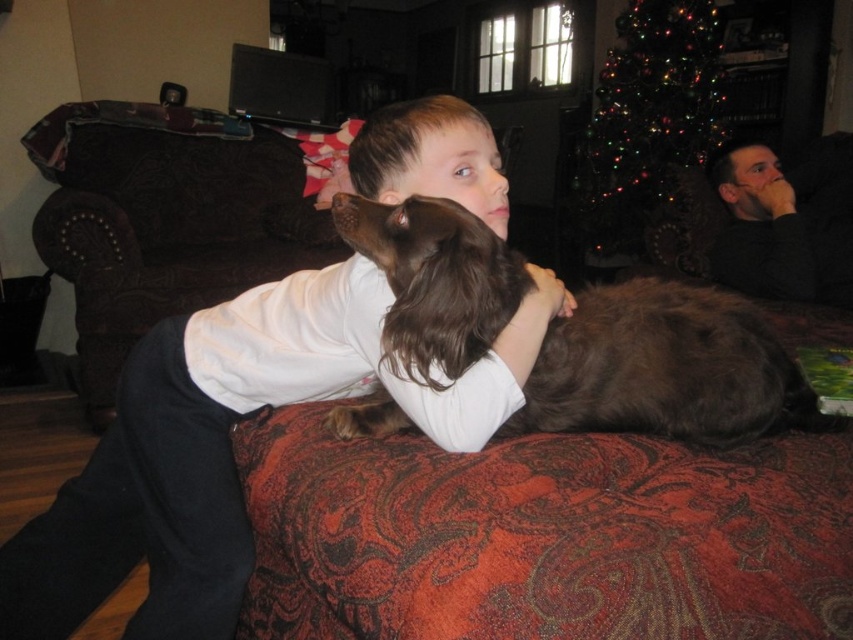
Question: Among these objects, which one is farthest from the camera?

Choices:
 (A) brown furry dog at center
 (B) brown fur at center

Answer: (B)

Question: Can you confirm if white soft shirt at center is bigger than brown furry dog at center?

Choices:
 (A) yes
 (B) no

Answer: (A)

Question: Is white soft shirt at center to the right of brown fur at center from the viewer's perspective?

Choices:
 (A) yes
 (B) no

Answer: (A)

Question: Among these objects, which one is farthest from the camera?

Choices:
 (A) brown furry dog at center
 (B) brown fur at center
 (C) white soft shirt at center

Answer: (B)

Question: Can you confirm if brown furry dog at center is positioned below brown fur at center?

Choices:
 (A) no
 (B) yes

Answer: (B)

Question: Which of the following is the closest to the observer?

Choices:
 (A) brown furry dog at center
 (B) white soft shirt at center

Answer: (A)